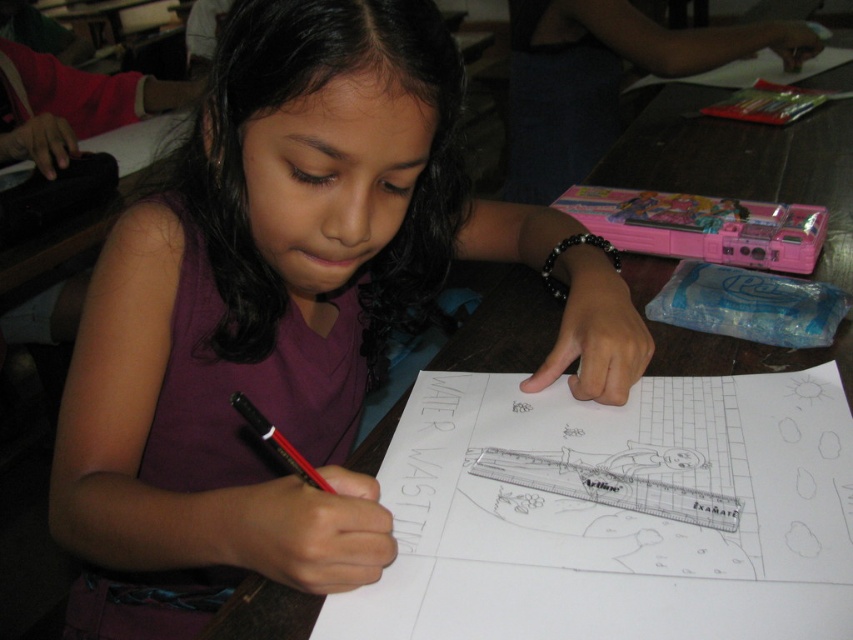
Question: In this image, where is matte purple shirt at center located relative to matte black pen at lower center?

Choices:
 (A) above
 (B) below

Answer: (A)

Question: Does matte purple shirt at center appear on the right side of matte black pen at lower center?

Choices:
 (A) no
 (B) yes

Answer: (A)

Question: Which point is farther from the camera taking this photo?

Choices:
 (A) (331, 291)
 (B) (303, 481)

Answer: (A)

Question: From the image, what is the correct spatial relationship of matte purple shirt at center in relation to matte black pen at lower center?

Choices:
 (A) above
 (B) below

Answer: (A)

Question: Among these points, which one is farthest from the camera?

Choices:
 (A) (260, 417)
 (B) (419, 221)

Answer: (B)

Question: Which point is closer to the camera?

Choices:
 (A) matte purple shirt at center
 (B) matte black pen at lower center

Answer: (A)